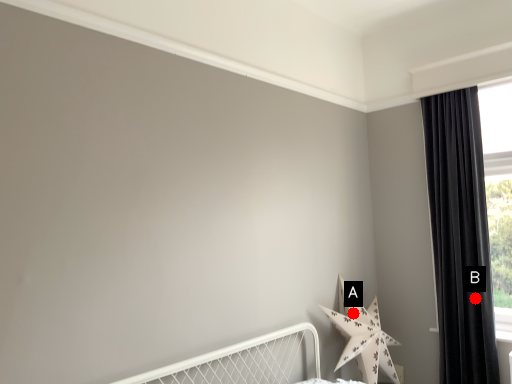
Question: Two points are circled on the image, labeled by A and B beside each circle. Which point is closer to the camera?

Choices:
 (A) A is closer
 (B) B is closer

Answer: (B)